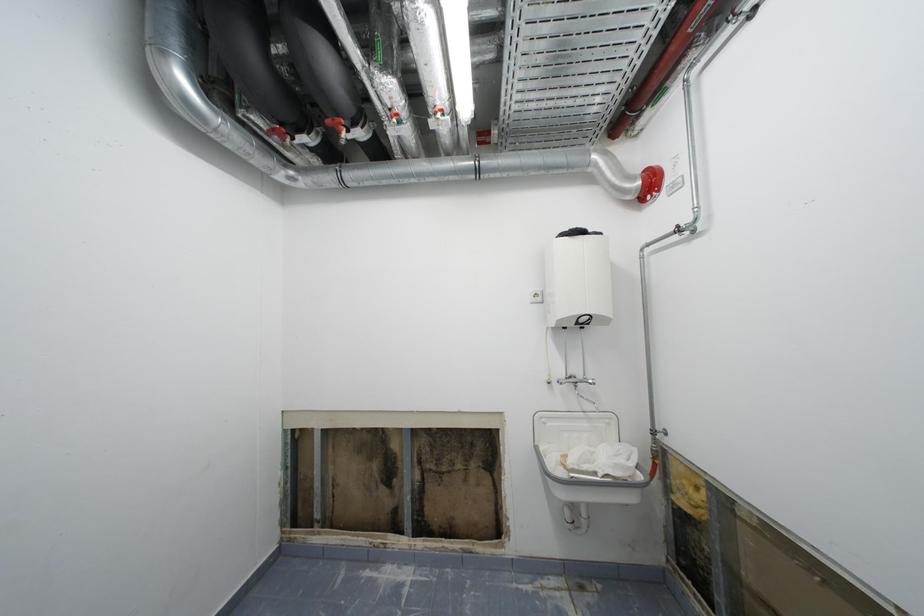
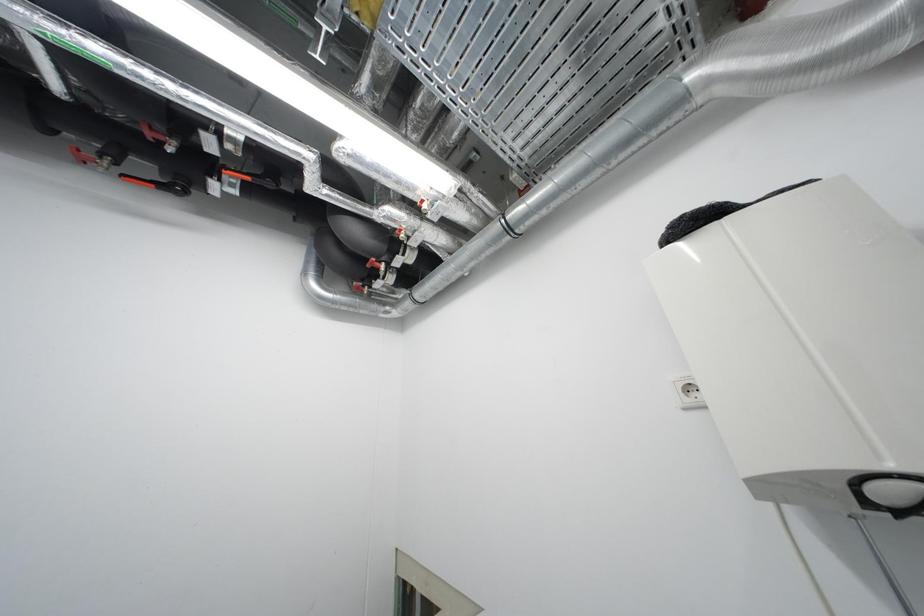
From the picture: Based on the continuous images, in which direction is the camera rotating?

The rotation direction of the camera is left-up.